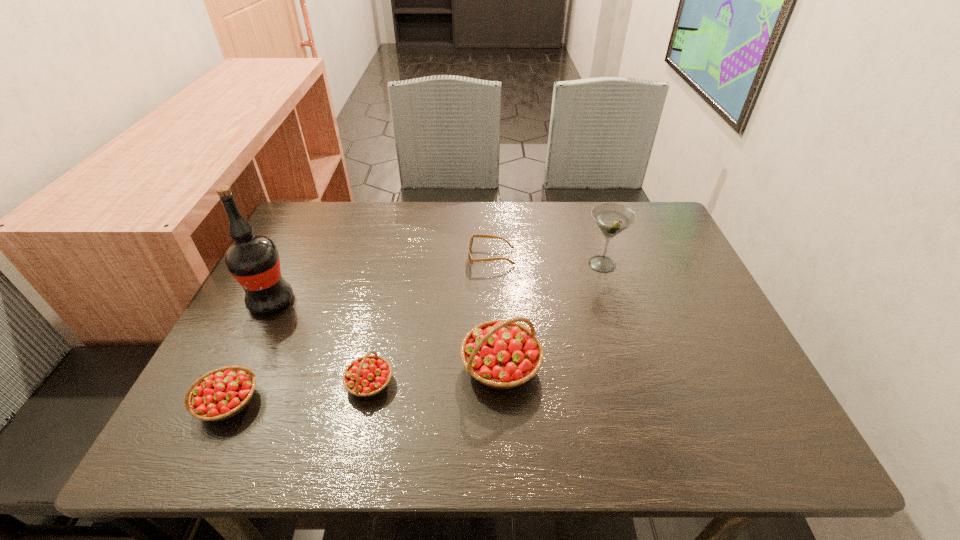
Identify the location of the shortest object. This screenshot has height=540, width=960. (471, 260).

Identify the location of blank space located 0.210m on the right of the second shortest strawberry. This screenshot has width=960, height=540. (366, 402).

Where is `vacant space positioned 0.300m on the back of the second shortest object`? vacant space positioned 0.300m on the back of the second shortest object is located at coordinates pos(395,271).

You are a GUI agent. You are given a task and a screenshot of the screen. Output one action in this format:
    pyautogui.click(x=<x>, y=<y>)
    Task: Click on the free spot located 0.360m on the right of the rightmost strawberry
    The width and height of the screenshot is (960, 540).
    Given the screenshot: What is the action you would take?
    pyautogui.click(x=712, y=366)

Find the location of `free space located 0.060m on the back of the martini`. free space located 0.060m on the back of the martini is located at coordinates (594, 238).

Where is `vacant space located 0.330m on the back of the third farthest object`? vacant space located 0.330m on the back of the third farthest object is located at coordinates (315, 212).

Where is `free space located on the front-facing side of the sunglasses`? free space located on the front-facing side of the sunglasses is located at coordinates (417, 258).

This screenshot has height=540, width=960. I want to click on vacant region located 0.060m on the front-facing side of the sunglasses, so click(446, 258).

Find the location of a particular element. free location located on the front-facing side of the sunglasses is located at coordinates (443, 258).

Locate an element on the screen. object situated at the far edge is located at coordinates (471, 260).